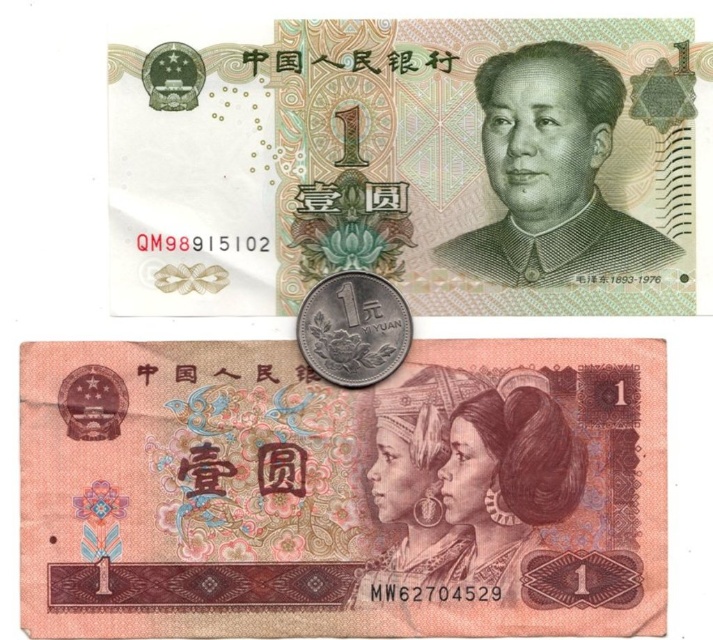
Can you confirm if matte paper banknote at center is smaller than silver metallic coin at center?

No.

Can you confirm if matte paper banknote at center is positioned to the left of silver metallic coin at center?

In fact, matte paper banknote at center is to the right of silver metallic coin at center.

This screenshot has height=640, width=713. In order to click on matte paper banknote at center in this screenshot , I will do `click(409, 166)`.

Is point (230, 342) positioned behind point (334, 307)?

Yes, point (230, 342) is behind point (334, 307).

Does point (241, 476) lie behind point (396, 304)?

No.

The image size is (713, 640). Find the location of `smooth paper banknote at center`. smooth paper banknote at center is located at coordinates (342, 490).

Consider the image. Which of these two, smooth paper banknote at center or matte paper banknote at center, stands taller?

Standing taller between the two is smooth paper banknote at center.

Identify the location of smooth paper banknote at center. The height and width of the screenshot is (640, 713). (342, 490).